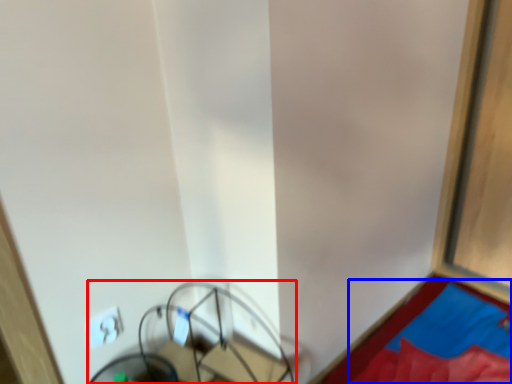
Question: Which point is closer to the camera, furniture (highlighted by a red box) or sheet (highlighted by a blue box)?

Choices:
 (A) furniture
 (B) sheet

Answer: (A)